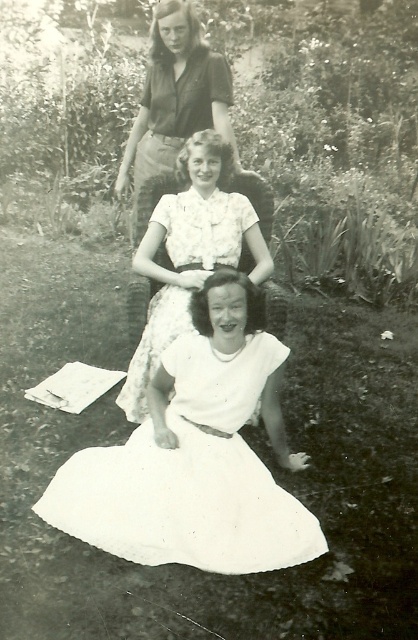
You are a photographer trying to capture a closeup of both the white cotton dress at lower center and the white satin dress at center. Given that your camera can only focus on objects within a 25 inch range, will you be able to capture both dresses in focus at the same time?

The white cotton dress at lower center and white satin dress at center are 27.46 inches apart from each other. Since the distance between them exceeds the camera focus range of 25 inches, you cannot capture both dresses in focus simultaneously.

Looking at this image, you are a photographer trying to capture a candid shot of both the white cotton dress at lower center and the white satin dress at center. Since you want to ensure both are in focus, which dress should you adjust your camera focus on first to account for their distances?

The white cotton dress at lower center is closer to the viewer than the white satin dress at center. To ensure both are in focus, you should focus on the white cotton dress at lower center first, as it is closer, and the depth of field will naturally extend to the farther subject.